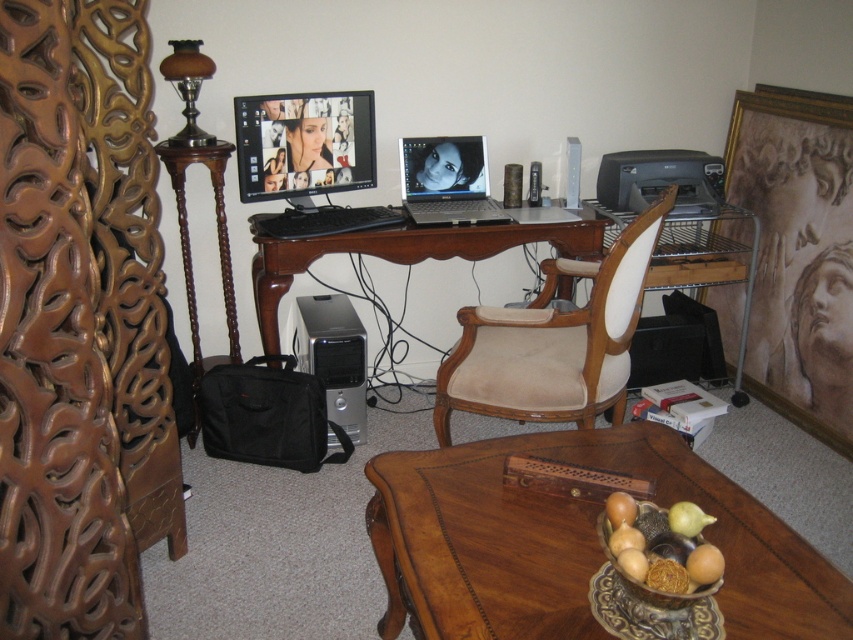
You are planning to rearrange your home office. You want to place a new 1.5 meter wide bookshelf in the center of the room. Considering the current placement of the beige fabric swivel chair at center and the brown wood computer desk at center, will there be enough space for the bookshelf?

The beige fabric swivel chair at center is larger in size than the brown wood computer desk at center. Since the chair is already occupying the central area, placing a 1.5 meter wide bookshelf there may not be feasible due to the existing large chair in that location.

You are sitting in the beige fabric swivel chair at center facing the brown wood computer desk at center. If you turn your head to look behind you, what would you see?

Since the beige fabric swivel chair at center is closer to the viewer than the brown wood computer desk at center, turning your head to look behind you would show the brown wood computer desk at center being further away from your current position, so you would see the desk in the background along with other items on it like the computer monitor and laptop.